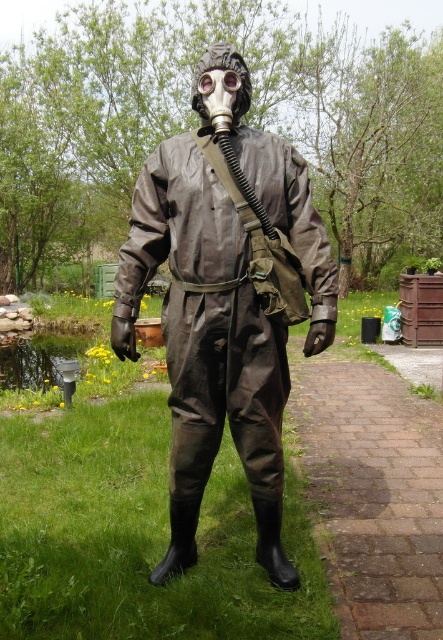
Can you confirm if brick pavement at lower right is bigger than transparent plastic goggles at center?

Yes.

Can you confirm if brick pavement at lower right is thinner than transparent plastic goggles at center?

Incorrect, brick pavement at lower right's width is not less than transparent plastic goggles at center's.

Which is in front, point (369, 396) or point (232, 86)?

Point (232, 86)

You are a GUI agent. You are given a task and a screenshot of the screen. Output one action in this format:
    pyautogui.click(x=<x>, y=<y>)
    Task: Click on the brick pavement at lower right
    The image size is (443, 640).
    Given the screenshot: What is the action you would take?
    pyautogui.click(x=373, y=492)

Between matte brown jumpsuit at center and transparent plastic goggles at center, which one is positioned lower?

matte brown jumpsuit at center is below.

Is matte brown jumpsuit at center below transparent plastic goggles at center?

Yes.

Which is behind, point (190, 252) or point (222, 77)?

Point (222, 77)

Locate an element on the screen. This screenshot has width=443, height=640. matte brown jumpsuit at center is located at coordinates [x=226, y=301].

I want to click on matte brown jumpsuit at center, so click(226, 301).

Locate an element on the screen. The width and height of the screenshot is (443, 640). matte brown jumpsuit at center is located at coordinates (226, 301).

Image resolution: width=443 pixels, height=640 pixels. What are the coordinates of `matte brown jumpsuit at center` in the screenshot? It's located at (226, 301).